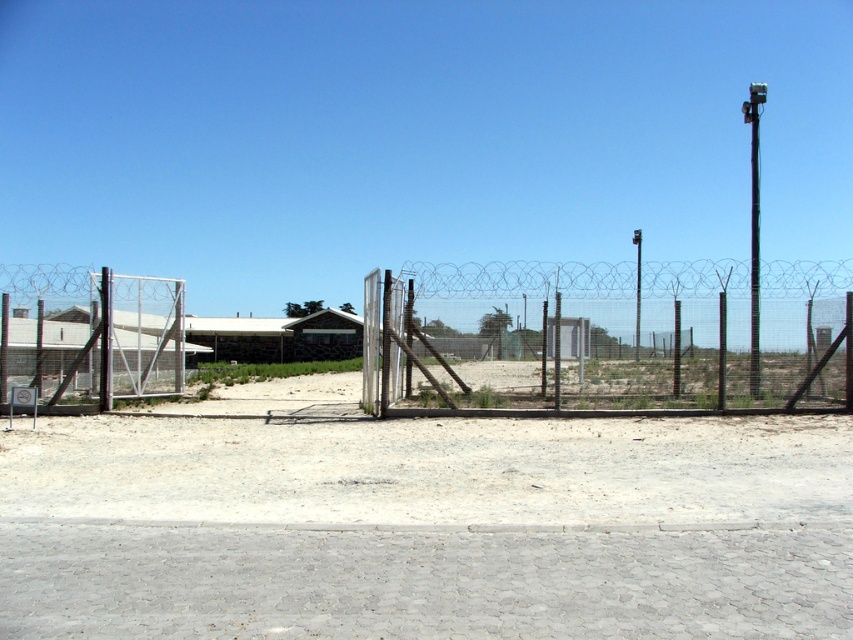
You are a delivery person trying to navigate through the secure area. You see the white sandy dirt at center and the metallic wire mesh fence at left. Which object is located below the other?

The white sandy dirt at center is positioned under the metallic wire mesh fence at left, meaning the sandy dirt is below the fence.

You are a delivery truck driver who needs to enter the secure area through the partially open gate. The truck is 5 meters wide. Is there enough space for the truck to pass through the gap between the gray cobblestone dirt track at lower center and the nearest fence post?

The gap between the gray cobblestone dirt track at lower center and the nearest fence post is 4.97 meters, which is slightly less than the truck width of 5 meters. Therefore, the truck cannot pass through the gap safely.

You are a delivery person trying to assess the height of the white sandy dirt at center and the black wire mesh fence at center in the image. Which one has a greater height?

The black wire mesh fence at center is taller than the white sandy dirt at center, so the black wire mesh fence at center has a greater height.